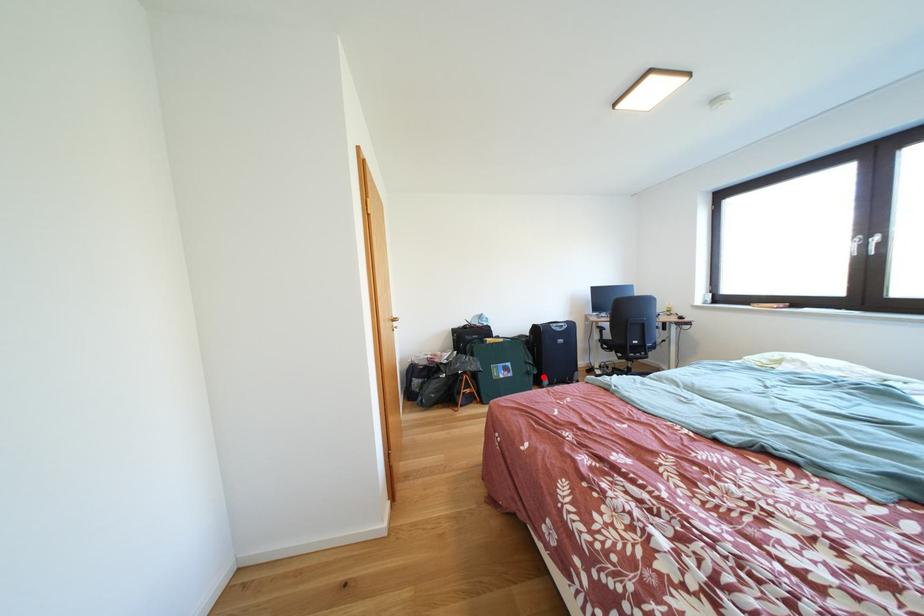
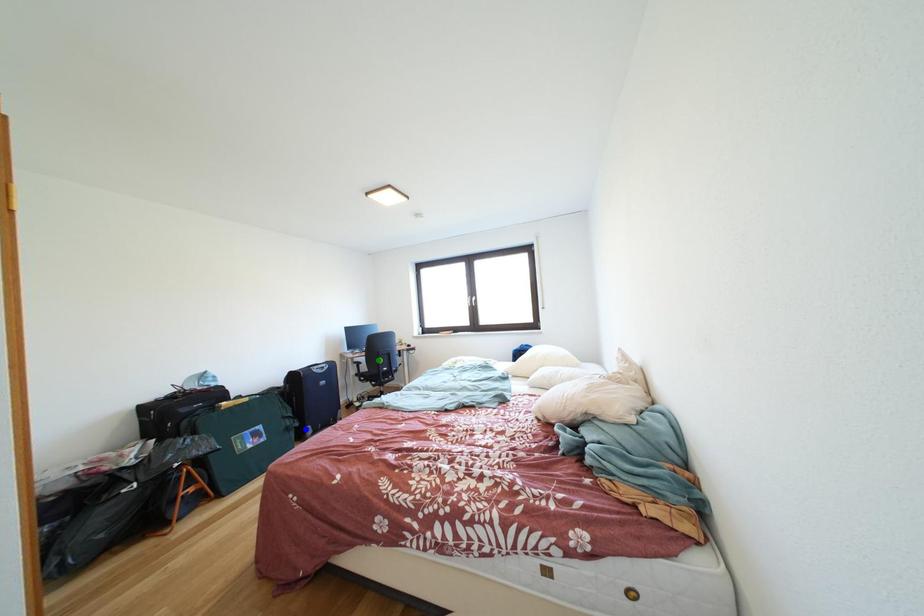
Question: I am providing you with two images of the same scene from different viewpoints. A red point is marked on the first image. You are given multiple points on the second image. Which point in image 2 is actually the same real-world point as the red point in image 1?

Choices:
 (A) blue point
 (B) yellow point
 (C) green point

Answer: (A)